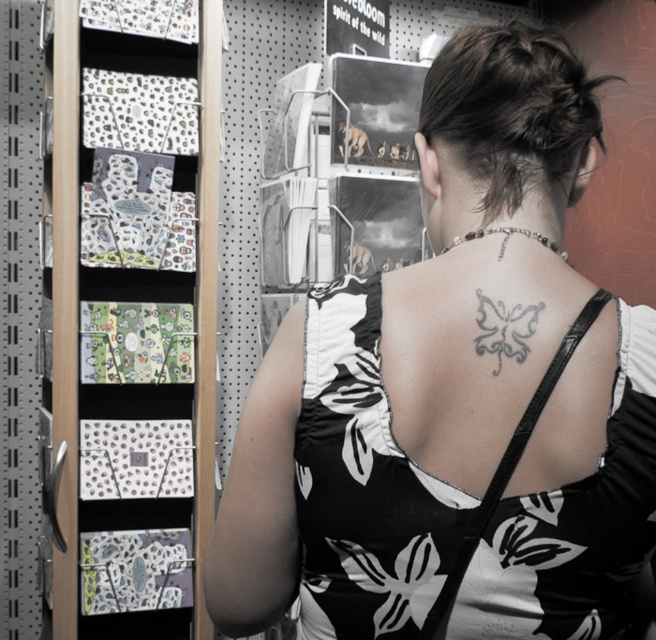
Question: Does gray/black ink butterfly at upper back have a greater width compared to silver metallic necklace at upper center?

Choices:
 (A) no
 (B) yes

Answer: (A)

Question: Which object appears farthest from the camera in this image?

Choices:
 (A) gray/black ink butterfly at upper back
 (B) silver metallic necklace at upper center

Answer: (B)

Question: Observing the image, what is the correct spatial positioning of dark brown hair at upper center in reference to silver metallic necklace at upper center?

Choices:
 (A) below
 (B) above

Answer: (B)

Question: Where is gray/black ink butterfly at upper back located in relation to silver metallic necklace at upper center in the image?

Choices:
 (A) above
 (B) below

Answer: (B)

Question: Which point is farther to the camera?

Choices:
 (A) (575, 168)
 (B) (501, 232)
 (C) (523, 332)

Answer: (A)

Question: Which point is closer to the camera?

Choices:
 (A) silver metallic necklace at upper center
 (B) black and white dress at center
 (C) dark brown hair at upper center
 (D) gray/black ink butterfly at upper back

Answer: (B)